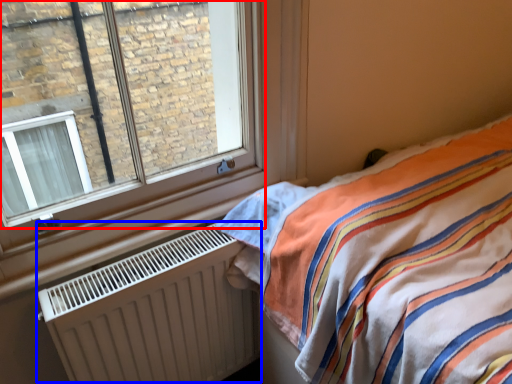
Question: Which point is closer to the camera, window (highlighted by a red box) or radiator (highlighted by a blue box)?

Choices:
 (A) window
 (B) radiator

Answer: (A)